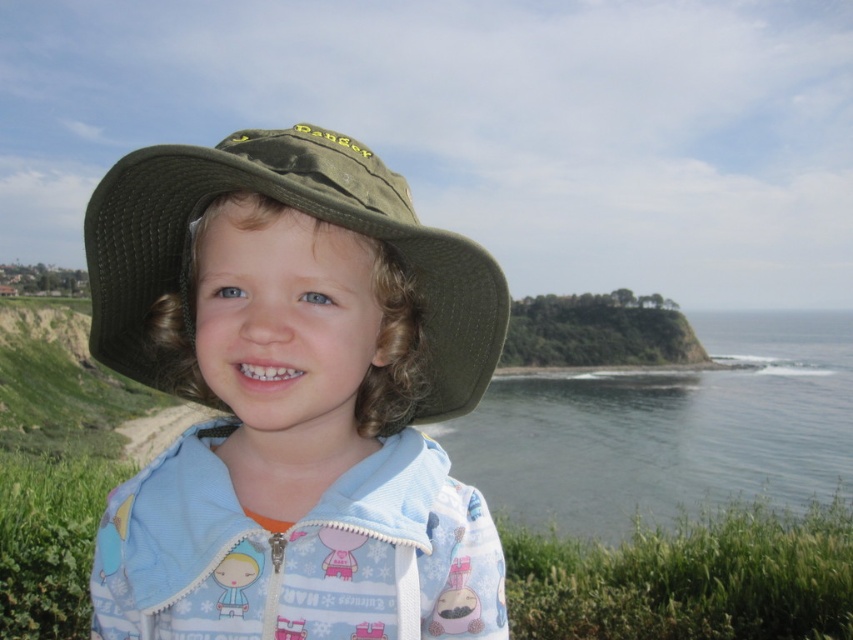
Question: Does clear blue water at lower right have a lesser width compared to green leafy cliff at center?

Choices:
 (A) no
 (B) yes

Answer: (A)

Question: Is clear blue water at lower right wider than green fabric hat at center?

Choices:
 (A) no
 (B) yes

Answer: (B)

Question: Which point is farther to the camera?

Choices:
 (A) (735, 449)
 (B) (144, 204)
 (C) (558, 316)

Answer: (C)

Question: Which point is farther from the camera taking this photo?

Choices:
 (A) (194, 314)
 (B) (848, 387)

Answer: (B)

Question: Which of the following is the farthest from the observer?

Choices:
 (A) (105, 256)
 (B) (616, 376)
 (C) (670, 353)

Answer: (C)

Question: Is clear blue water at lower right to the right of green leafy cliff at center from the viewer's perspective?

Choices:
 (A) yes
 (B) no

Answer: (A)